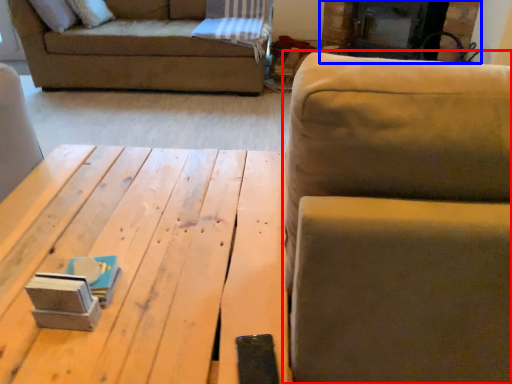
Question: Which object appears farthest to the camera in this image, studio couch (highlighted by a red box) or fireplace (highlighted by a blue box)?

Choices:
 (A) studio couch
 (B) fireplace

Answer: (B)